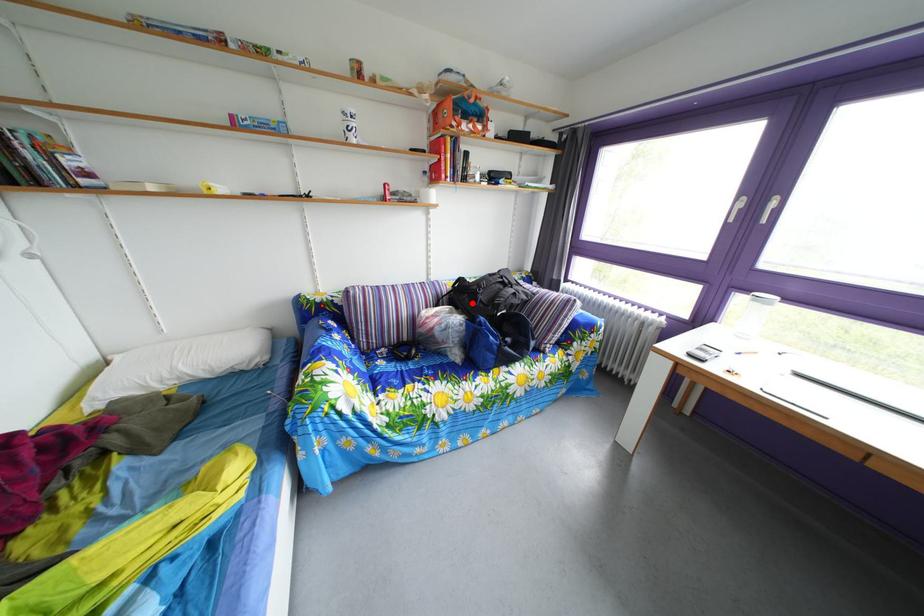
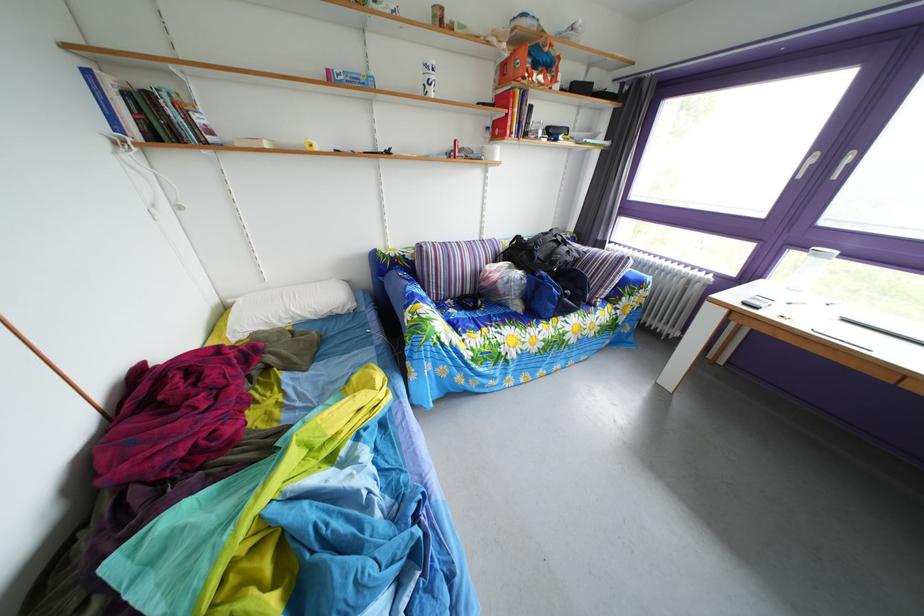
Question: I am providing you with two images of the same scene from different viewpoints. In image1, a red point is highlighted. Considering the same 3D point in image2, which of the following is correct?

Choices:
 (A) It is closer
 (B) It is farther

Answer: (A)